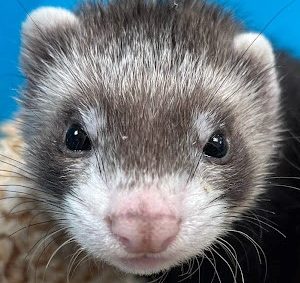
Where is `blanket`? This screenshot has height=283, width=300. blanket is located at coordinates (12, 253).